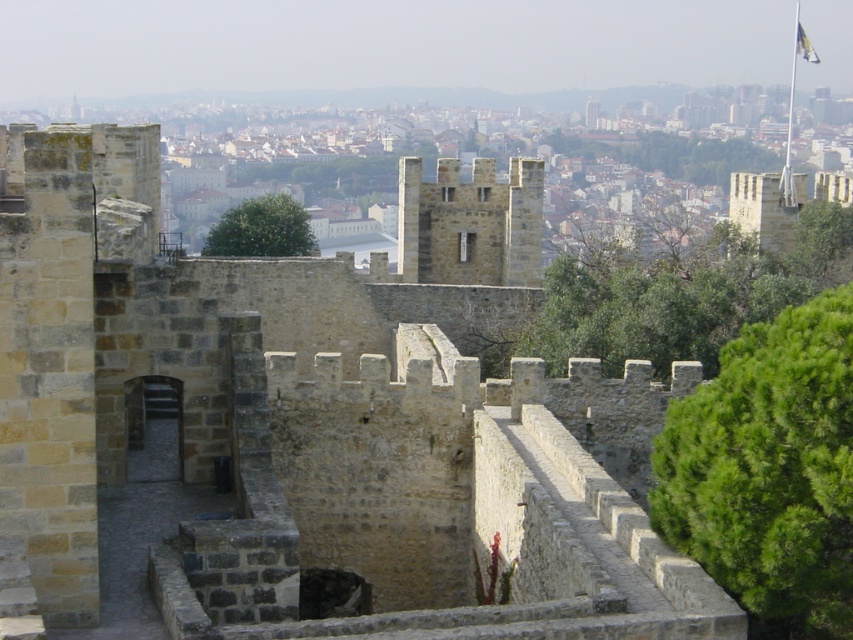
Is point (107, 396) in front of point (813, 56)?

Yes, it is.

The width and height of the screenshot is (853, 640). I want to click on stone wall at center, so click(x=312, y=428).

At what (x,y) coordinates should I click in order to perform the action: click on stone wall at center. Please return your answer as a coordinate pair (x, y). This screenshot has width=853, height=640. Looking at the image, I should click on (312, 428).